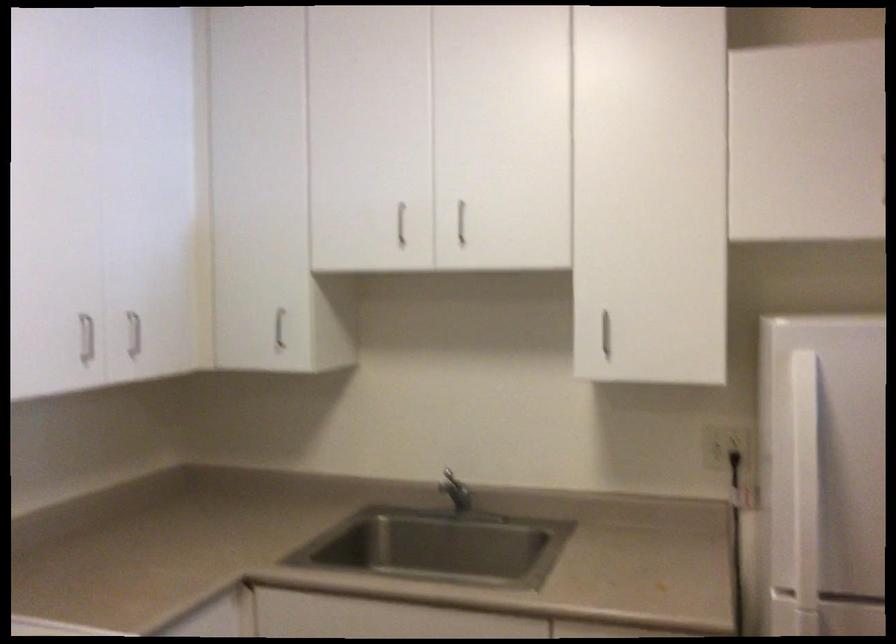
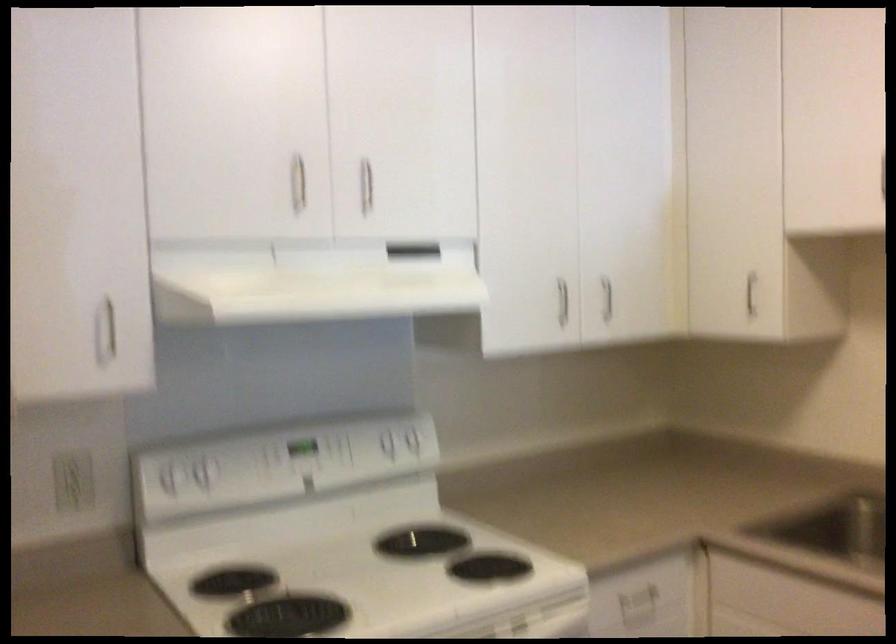
Question: The images are taken continuously from a first-person perspective. In which direction is your viewpoint rotating?

Choices:
 (A) Left
 (B) Right
 (C) Up
 (D) Down

Answer: (A)